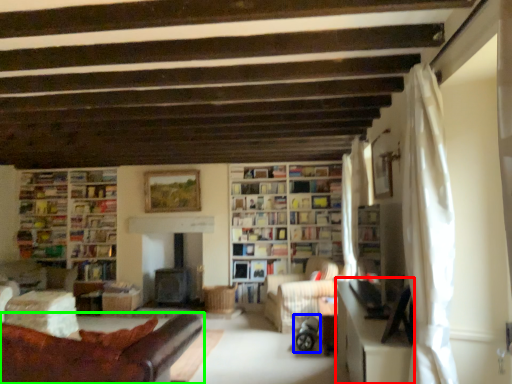
Question: Which is farther away from table (highlighted by a red box)? baby carriage (highlighted by a blue box) or studio couch (highlighted by a green box)?

Choices:
 (A) baby carriage
 (B) studio couch

Answer: (A)